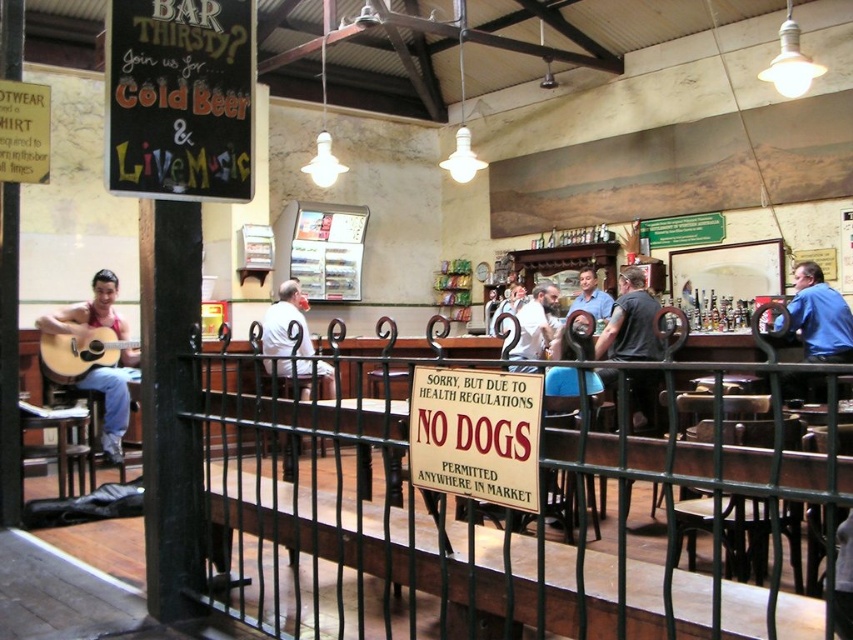
You are a bartender who needs to hand a drink to a customer wearing the matte red shirt at left and another to someone wearing the light brown leather jacket at center. If you can only carry two drinks at once, can you place both drinks on the bar counter without moving from your current position?

The matte red shirt at left and light brown leather jacket at center are 9.97 feet apart. Since the distance between them is more than arm length, you cannot reach both customers at the same time without moving, so you should deliver the drinks one at a time.

You are standing at the entrance of the bar and want to find the matte red shirt at left. According to the image, where should you look to find it?

The matte red shirt at left is located at the coordinates point (113, 397) in the image.